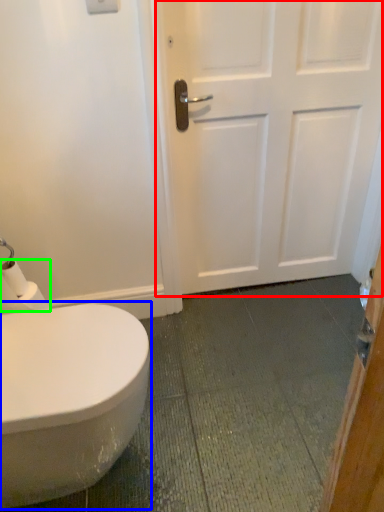
Question: Estimate the real-world distances between objects in this image. Which object is farther from door (highlighted by a red box), bidet (highlighted by a blue box) or toilet paper (highlighted by a green box)?

Choices:
 (A) bidet
 (B) toilet paper

Answer: (B)